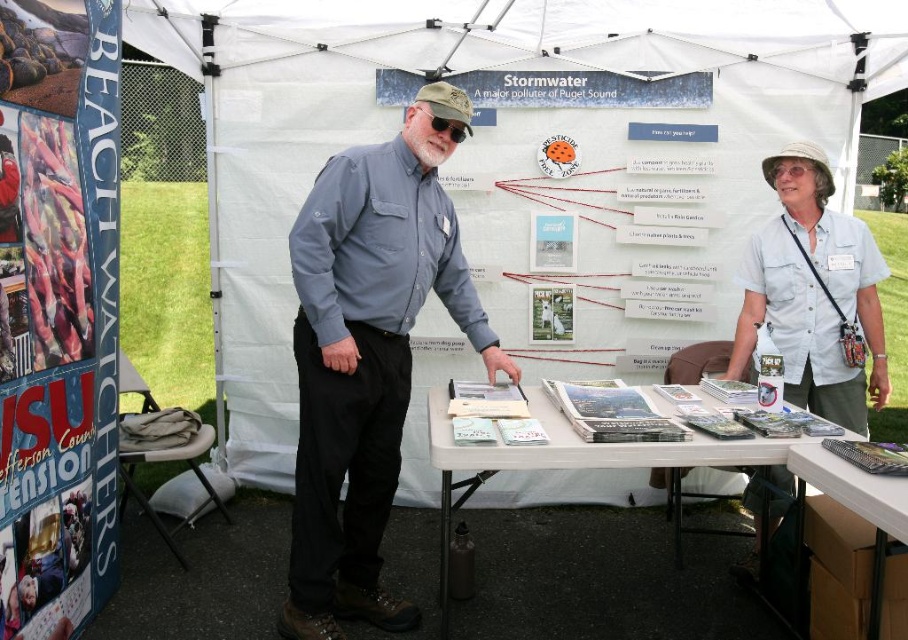
Does matte blue shirt at center appear on the right side of white paper table at center?

Incorrect, matte blue shirt at center is not on the right side of white paper table at center.

Who is positioned more to the left, matte blue shirt at center or white paper table at center?

From the viewer's perspective, matte blue shirt at center appears more on the left side.

Image resolution: width=908 pixels, height=640 pixels. Describe the element at coordinates (368, 353) in the screenshot. I see `matte blue shirt at center` at that location.

Where is `matte blue shirt at center`? matte blue shirt at center is located at coordinates (368, 353).

Which is below, white fabric tent at center or blue paper poster at left?

Positioned lower is blue paper poster at left.

Does white fabric tent at center have a lesser width compared to blue paper poster at left?

Incorrect, white fabric tent at center's width is not less than blue paper poster at left's.

Between point (423, 380) and point (28, 339), which one is positioned behind?

Positioned behind is point (423, 380).

At what (x,y) coordinates should I click in order to perform the action: click on white fabric tent at center. Please return your answer as a coordinate pair (x, y). The image size is (908, 640). Looking at the image, I should click on (519, 160).

Between blue paper poster at left and white plastic table at lower right, which one appears on the right side from the viewer's perspective?

Positioned to the right is white plastic table at lower right.

From the picture: Which is more to the left, blue paper poster at left or white plastic table at lower right?

From the viewer's perspective, blue paper poster at left appears more on the left side.

Who is more forward, (58, 374) or (870, 518)?

Point (870, 518) is in front.

Find the location of `blue paper poster at left`. blue paper poster at left is located at coordinates (57, 310).